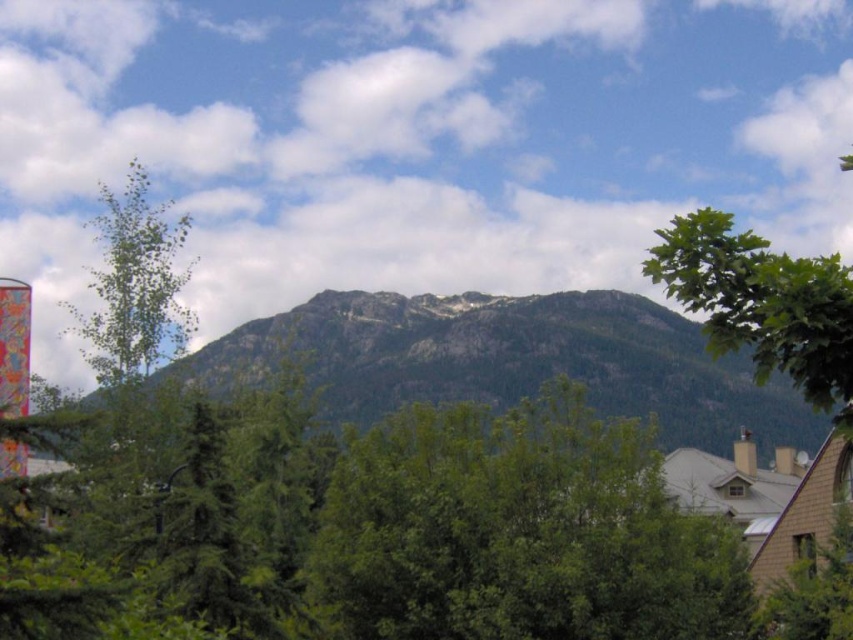
You are standing at a scenic viewpoint overlooking the mountain range and residential area. You notice a specific point marked at coordinates point (521, 636). If you want to reach that point as quickly as possible, which direction should you move in relation to the camera position?

The point (521, 636) is 67.11 meters away from the camera. To reach it quickly, you should move directly towards the direction where the point is located relative to your current position.

You are planning to take a photo of the green leafy tree at center and the rocky gray mountain at center. Which object will appear wider in the photo?

The rocky gray mountain at center will appear wider in the photo because its width is greater than that of the green leafy tree at center.

You are a hiker standing at the base of the mountain and want to take a photo of both the green leafy tree at center and the green leafy tree at upper right. Which tree should you move closer to in order to make both trees appear equally sized in your photo?

To make both the green leafy tree at center and the green leafy tree at upper right appear equally sized in your photo, you should move closer to the green leafy tree at center since it is smaller than the green leafy tree at upper right.